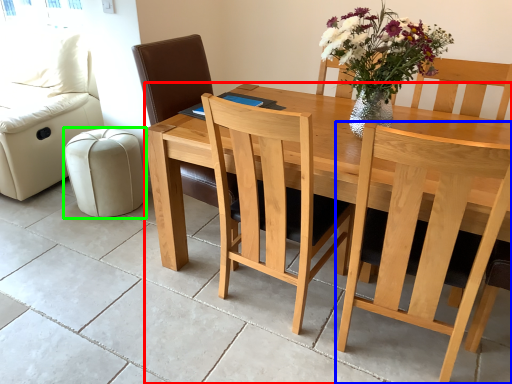
Question: Considering the real-world distances, which object is farthest from table (highlighted by a red box)? chair (highlighted by a blue box) or stool (highlighted by a green box)?

Choices:
 (A) chair
 (B) stool

Answer: (B)